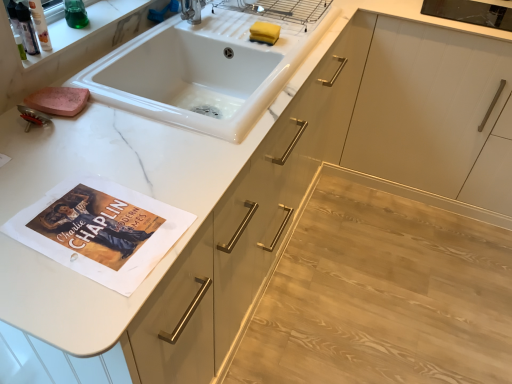
I want to click on free space behind yellow sponge at sink, so click(264, 18).